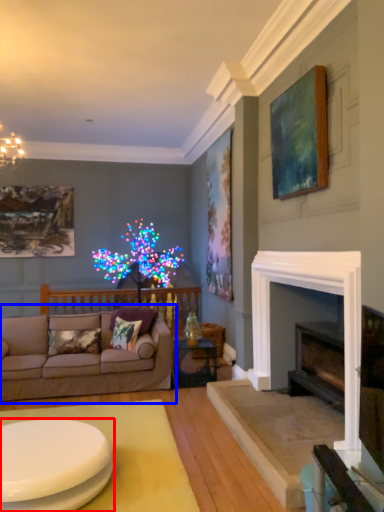
Question: Which point is further to the camera, coffee table (highlighted by a red box) or studio couch (highlighted by a blue box)?

Choices:
 (A) coffee table
 (B) studio couch

Answer: (B)